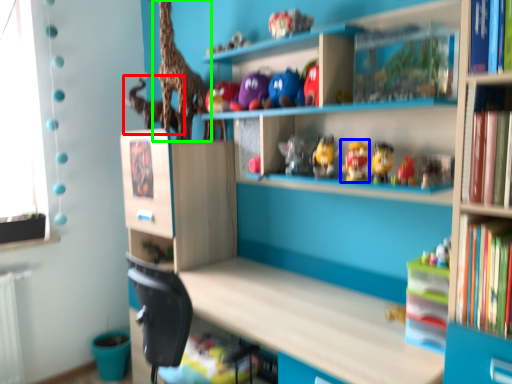
Question: Which object is positioned closest to animal (highlighted by a red box)? Select from toy (highlighted by a blue box) and giraffe (highlighted by a green box).

Choices:
 (A) toy
 (B) giraffe

Answer: (B)